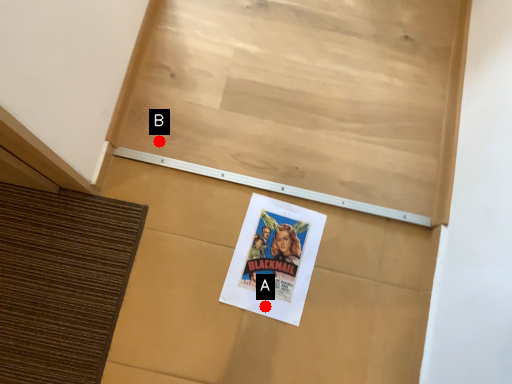
Question: Two points are circled on the image, labeled by A and B beside each circle. Among these points, which one is nearest to the camera?

Choices:
 (A) A is closer
 (B) B is closer

Answer: (A)